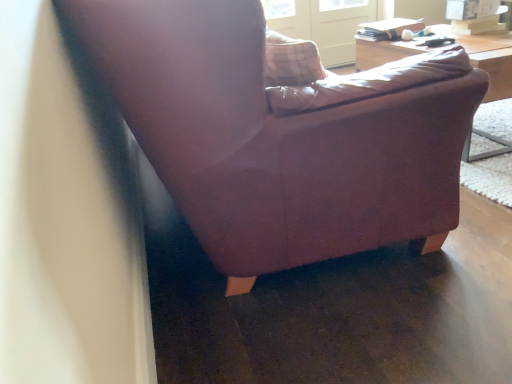
Question: Would you say wooden table at upper right is a long distance from clear glass screen door at upper center?

Choices:
 (A) yes
 (B) no

Answer: (A)

Question: Is wooden table at upper right completely or partially outside of clear glass screen door at upper center?

Choices:
 (A) no
 (B) yes

Answer: (B)

Question: Does wooden table at upper right have a lesser width compared to clear glass screen door at upper center?

Choices:
 (A) no
 (B) yes

Answer: (A)

Question: Is wooden table at upper right next to clear glass screen door at upper center?

Choices:
 (A) no
 (B) yes

Answer: (A)

Question: Does wooden table at upper right have a greater width compared to clear glass screen door at upper center?

Choices:
 (A) yes
 (B) no

Answer: (A)

Question: Does point (494, 39) appear closer or farther from the camera than point (180, 165)?

Choices:
 (A) farther
 (B) closer

Answer: (A)

Question: Is wooden table at upper right inside or outside of matte purple armchair at center?

Choices:
 (A) outside
 (B) inside

Answer: (A)

Question: From a real-world perspective, is wooden table at upper right above or below matte purple armchair at center?

Choices:
 (A) below
 (B) above

Answer: (B)

Question: Is wooden table at upper right taller or shorter than matte purple armchair at center?

Choices:
 (A) tall
 (B) short

Answer: (A)

Question: From the image's perspective, relative to clear glass screen door at upper center, is matte purple armchair at center above or below?

Choices:
 (A) below
 (B) above

Answer: (A)

Question: Is matte purple armchair at center taller or shorter than clear glass screen door at upper center?

Choices:
 (A) tall
 (B) short

Answer: (B)

Question: Relative to clear glass screen door at upper center, is matte purple armchair at center in front or behind?

Choices:
 (A) behind
 (B) front

Answer: (B)

Question: Is point (186, 173) positioned closer to the camera than point (312, 1)?

Choices:
 (A) farther
 (B) closer

Answer: (B)

Question: Considering the positions of point coord(501,67) and point coord(342,46), is point coord(501,67) closer or farther from the camera than point coord(342,46)?

Choices:
 (A) farther
 (B) closer

Answer: (B)

Question: Considering the positions of wooden table at upper right and clear glass screen door at upper center in the image, is wooden table at upper right bigger or smaller than clear glass screen door at upper center?

Choices:
 (A) big
 (B) small

Answer: (A)